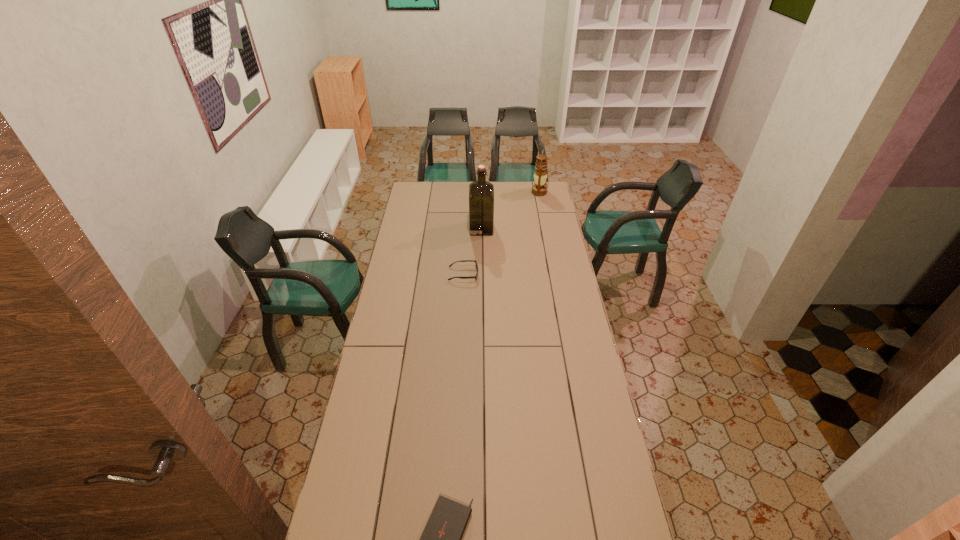
Identify the location of vacant space that's between the third nearest object and the second nearest object. (472, 251).

At what (x,y) coordinates should I click in order to perform the action: click on free point between the farthest object and the sunglasses. Please return your answer as a coordinate pair (x, y). The height and width of the screenshot is (540, 960). Looking at the image, I should click on (501, 233).

What are the coordinates of `object that stands as the closest to the farthest object` in the screenshot? It's located at (481, 192).

Identify the location of object that is the third closest to the sunglasses. This screenshot has height=540, width=960. (441, 539).

Identify the location of vacant area in the image that satisfies the following two spatial constraints: 1. on the front side of the second tallest object; 2. on the front-facing side of the third tallest object. This screenshot has height=540, width=960. (555, 274).